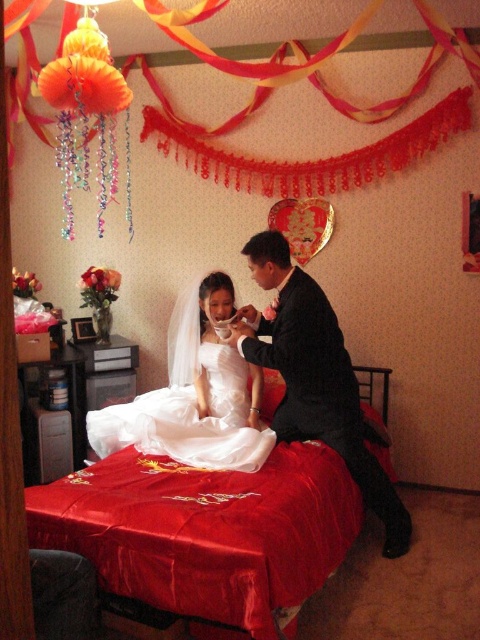
Question: Is shiny black suit at center wider than black marble chair at lower left?

Choices:
 (A) yes
 (B) no

Answer: (A)

Question: Estimate the real-world distances between objects in this image. Which object is closer to the shiny black suit at center?

Choices:
 (A) silky satin bed at center
 (B) black marble chair at lower left
 (C) white satin dress at center

Answer: (C)

Question: Which point is farther to the camera?

Choices:
 (A) (300, 536)
 (B) (33, 561)

Answer: (A)

Question: Which point is closer to the camera taking this photo?

Choices:
 (A) (373, 492)
 (B) (52, 595)
 (C) (207, 604)

Answer: (B)

Question: Does shiny black suit at center appear over white satin dress at center?

Choices:
 (A) yes
 (B) no

Answer: (B)

Question: Does shiny black suit at center lie behind black marble chair at lower left?

Choices:
 (A) no
 (B) yes

Answer: (B)